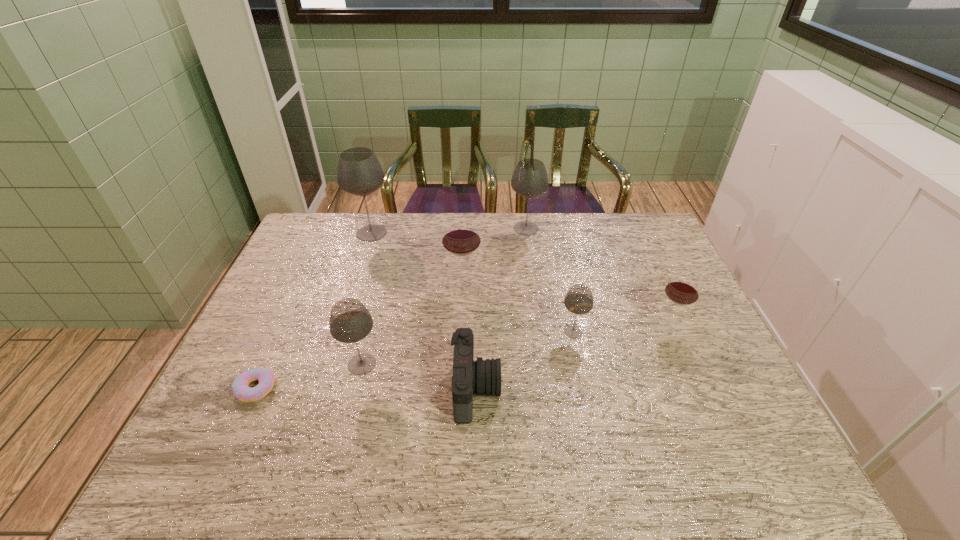
Where is `vacant space situated 0.170m at the lens of the seventh tallest object`? This screenshot has width=960, height=540. vacant space situated 0.170m at the lens of the seventh tallest object is located at coordinates (568, 389).

At what (x,y) coordinates should I click in order to perform the action: click on vacant space located 0.130m on the back of the leftmost object. Please return your answer as a coordinate pair (x, y). The width and height of the screenshot is (960, 540). Looking at the image, I should click on (279, 335).

Identify the location of object that is at the left edge. Image resolution: width=960 pixels, height=540 pixels. (240, 389).

Identify the location of object that is at the right edge. The width and height of the screenshot is (960, 540). (682, 289).

This screenshot has width=960, height=540. Identify the location of vacant space at the far edge of the desktop. (606, 245).

In the image, there is a desktop. Identify the location of free region at the near edge. The height and width of the screenshot is (540, 960). (506, 453).

This screenshot has height=540, width=960. In the image, there is a desktop. What are the coordinates of `vacant region at the left edge` in the screenshot? It's located at (284, 275).

Where is `free space at the right edge`? free space at the right edge is located at coordinates (714, 420).

In the image, there is a desktop. Find the location of `vacant space at the far right corner`. vacant space at the far right corner is located at coordinates (654, 221).

You are a GUI agent. You are given a task and a screenshot of the screen. Output one action in this format:
    pyautogui.click(x=<x>, y=<y>)
    Task: Click on the free space between the fifth shortest wineglass and the third farthest gray wineglass
    
    Given the screenshot: What is the action you would take?
    pyautogui.click(x=549, y=280)